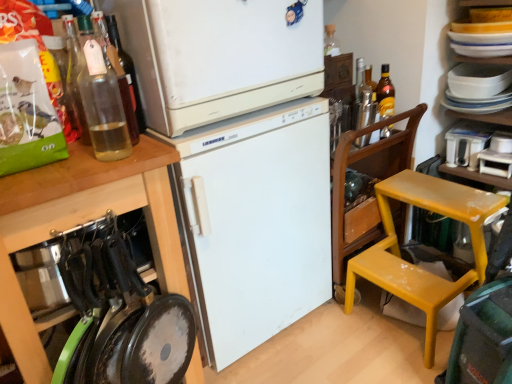
In order to click on free point in front of clear glass bottle at upper left, which appears as the 1th bottle when viewed from the left in this screenshot , I will do `click(80, 175)`.